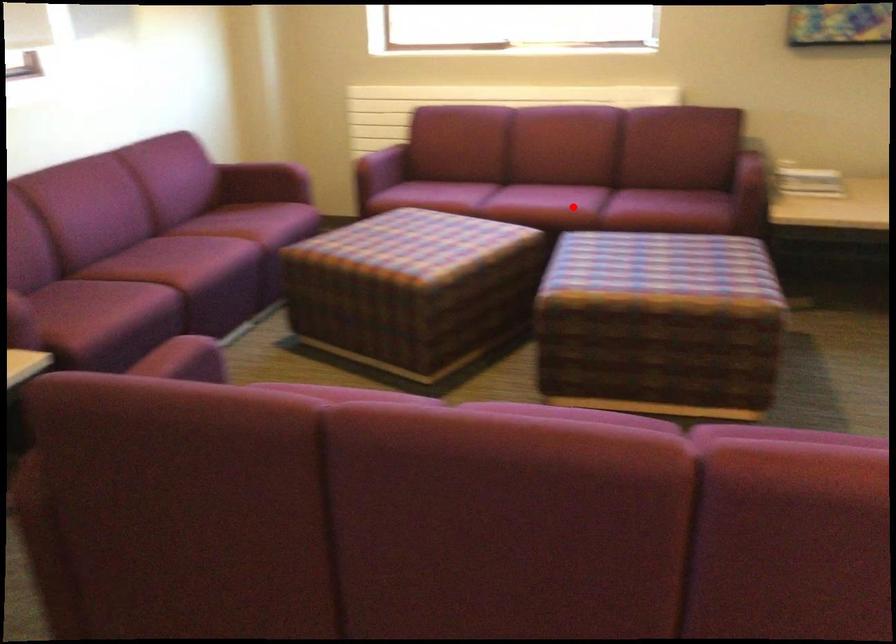
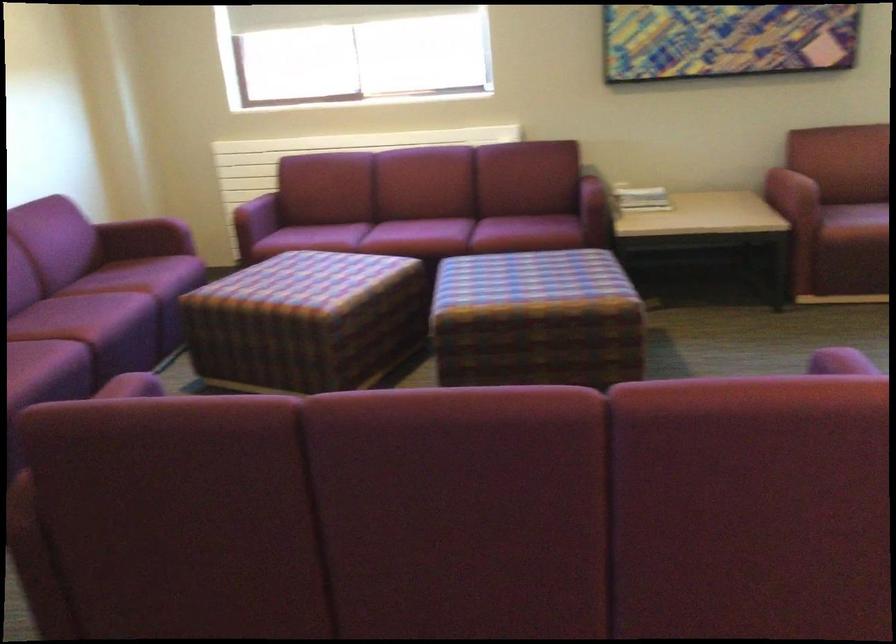
The point at the highlighted location is marked in the first image. Where is the corresponding point in the second image?

(445, 236)